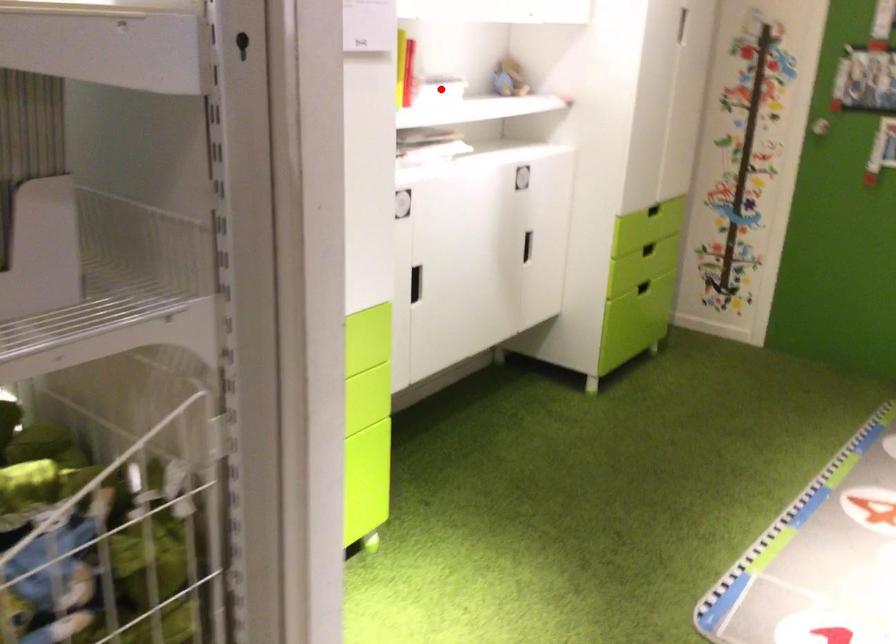
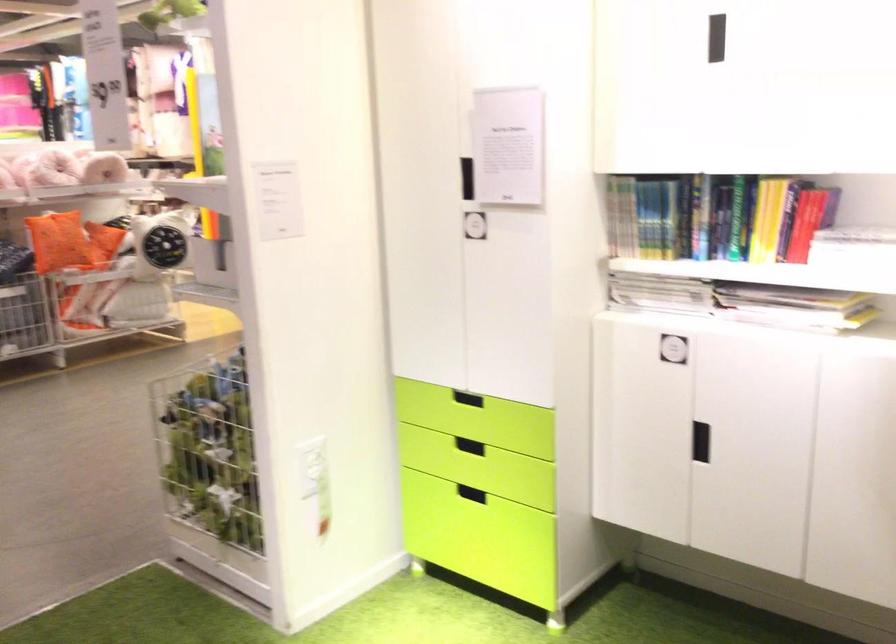
The point at the highlighted location is marked in the first image. Where is the corresponding point in the second image?

(853, 245)